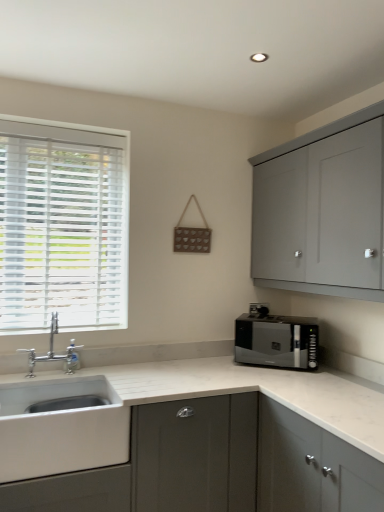
At what (x,y) coordinates should I click in order to perform the action: click on vacant area on top of white wood blinds at left (from a real-world perspective). Please return your answer as a coordinate pair (x, y). Image resolution: width=384 pixels, height=512 pixels. Looking at the image, I should click on (68, 130).